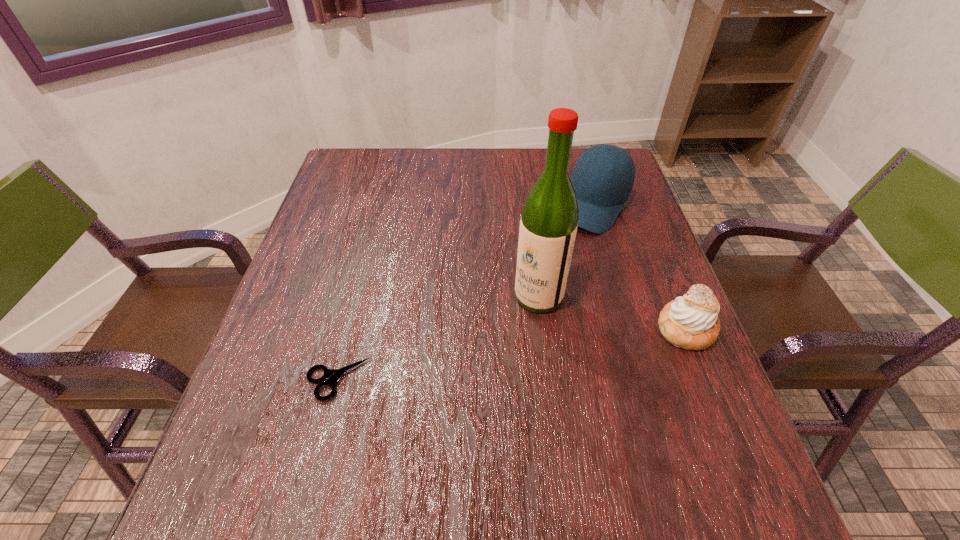
I want to click on free region located 0.060m on the front-facing side of the farthest object, so click(x=571, y=245).

This screenshot has height=540, width=960. Find the location of `vacant space located 0.330m on the front-facing side of the farthest object`. vacant space located 0.330m on the front-facing side of the farthest object is located at coordinates (525, 316).

Identify the location of free space located on the label of the second object from left to right. (498, 335).

Identify the location of blank space located on the label of the second object from left to right. This screenshot has width=960, height=540. (405, 423).

The width and height of the screenshot is (960, 540). In order to click on vacant space located on the label of the second object from left to right in this screenshot , I will do `click(452, 379)`.

Find the location of `object that is at the far edge`. object that is at the far edge is located at coordinates (601, 191).

Identify the location of object at the left edge. This screenshot has width=960, height=540. (332, 375).

You are a GUI agent. You are given a task and a screenshot of the screen. Output one action in this format:
    pyautogui.click(x=<x>, y=<y>)
    Task: Click on the pastry positioned at the right edge
    
    Given the screenshot: What is the action you would take?
    pyautogui.click(x=691, y=322)

The image size is (960, 540). I want to click on baseball cap located at the right edge, so click(x=601, y=191).

Locate an element on the screen. object that is at the far right corner is located at coordinates (601, 191).